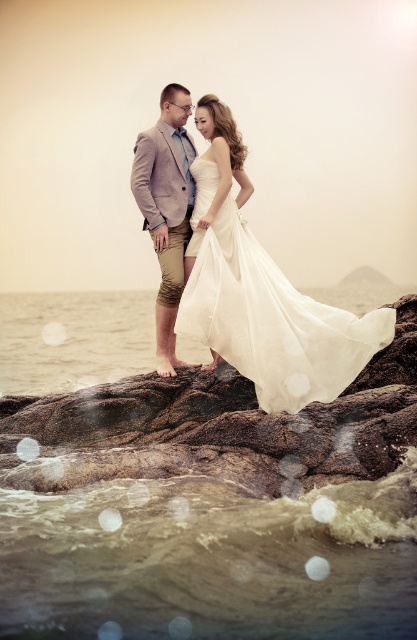
Who is more distant from viewer, (198, 406) or (201, 120)?

The point (201, 120) is more distant.

The width and height of the screenshot is (417, 640). Identify the location of translucent water at rock bottom. 211,508.

Find the location of a particular element. This screenshot has width=417, height=640. translucent water at rock bottom is located at coordinates [211, 508].

Does point (256, 333) come closer to viewer compared to point (175, 304)?

That is True.

Who is higher up, white sheer dress at center or light brown textured shorts at center?

light brown textured shorts at center

Who is more forward, (334, 365) or (145, 204)?

Point (334, 365) is more forward.

Locate an element on the screen. The width and height of the screenshot is (417, 640). white sheer dress at center is located at coordinates (268, 312).

Is light brown textured shorts at center wider than satin white dress at center?

Indeed, light brown textured shorts at center has a greater width compared to satin white dress at center.

Can you confirm if light brown textured shorts at center is taller than satin white dress at center?

Correct, light brown textured shorts at center is much taller as satin white dress at center.

Which is behind, point (183, 244) or point (200, 122)?

The point (200, 122) is more distant.

Where is `light brown textured shorts at center`? light brown textured shorts at center is located at coordinates (166, 209).